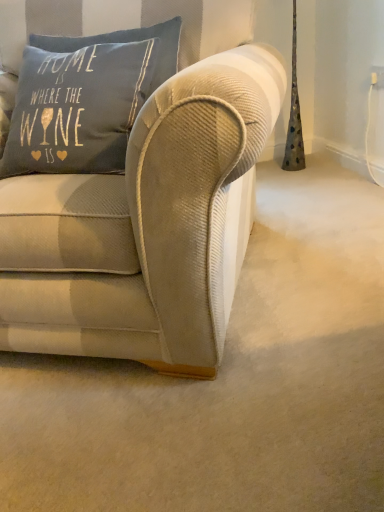
Question: Would you say blue cotton pillow at upper left, the 1th pillow from the bottom, is part of textured gray pillow at upper left, which is the first pillow from top to bottom,'s contents?

Choices:
 (A) no
 (B) yes

Answer: (A)

Question: From the image's perspective, is textured gray pillow at upper left, which ranks as the second pillow in bottom-to-top order, above blue cotton pillow at upper left, which is the 2th pillow in top-to-bottom order?

Choices:
 (A) yes
 (B) no

Answer: (A)

Question: Does textured gray pillow at upper left, which is the first pillow from top to bottom, have a lesser width compared to blue cotton pillow at upper left, which is the 2th pillow in top-to-bottom order?

Choices:
 (A) yes
 (B) no

Answer: (A)

Question: Are textured gray pillow at upper left, which is the first pillow from top to bottom, and blue cotton pillow at upper left, which is the 2th pillow in top-to-bottom order, located far from each other?

Choices:
 (A) yes
 (B) no

Answer: (B)

Question: Does textured gray pillow at upper left, which is the first pillow from top to bottom, appear on the right side of blue cotton pillow at upper left, which is the 2th pillow in top-to-bottom order?

Choices:
 (A) no
 (B) yes

Answer: (B)

Question: Considering the relative positions of textured gray pillow at upper left, which is the first pillow from top to bottom, and blue cotton pillow at upper left, the 1th pillow from the bottom, in the image provided, is textured gray pillow at upper left, which is the first pillow from top to bottom, to the left or to the right of blue cotton pillow at upper left, the 1th pillow from the bottom,?

Choices:
 (A) right
 (B) left

Answer: (A)

Question: Is textured gray pillow at upper left, which ranks as the second pillow in bottom-to-top order, wider or thinner than blue cotton pillow at upper left, which is the 2th pillow in top-to-bottom order?

Choices:
 (A) wide
 (B) thin

Answer: (B)

Question: Is point (81, 44) closer or farther from the camera than point (117, 153)?

Choices:
 (A) farther
 (B) closer

Answer: (A)

Question: Considering their positions, is textured gray pillow at upper left, which ranks as the second pillow in bottom-to-top order, located in front of or behind blue cotton pillow at upper left, which is the 2th pillow in top-to-bottom order?

Choices:
 (A) behind
 (B) front

Answer: (A)

Question: Is blue cotton pillow at upper left, which is the 2th pillow in top-to-bottom order, to the left or to the right of beige corduroy couch at center in the image?

Choices:
 (A) left
 (B) right

Answer: (B)

Question: Considering their positions, is blue cotton pillow at upper left, which is the 2th pillow in top-to-bottom order, located in front of or behind beige corduroy couch at center?

Choices:
 (A) behind
 (B) front

Answer: (A)

Question: In terms of size, does blue cotton pillow at upper left, the 1th pillow from the bottom, appear bigger or smaller than beige corduroy couch at center?

Choices:
 (A) big
 (B) small

Answer: (B)

Question: Is point (92, 128) closer or farther from the camera than point (180, 355)?

Choices:
 (A) closer
 (B) farther

Answer: (B)

Question: Considering the positions of point (41, 307) and point (107, 35), is point (41, 307) closer or farther from the camera than point (107, 35)?

Choices:
 (A) closer
 (B) farther

Answer: (A)

Question: Considering the positions of beige corduroy couch at center and textured gray pillow at upper left, which ranks as the second pillow in bottom-to-top order, in the image, is beige corduroy couch at center taller or shorter than textured gray pillow at upper left, which ranks as the second pillow in bottom-to-top order,?

Choices:
 (A) short
 (B) tall

Answer: (B)